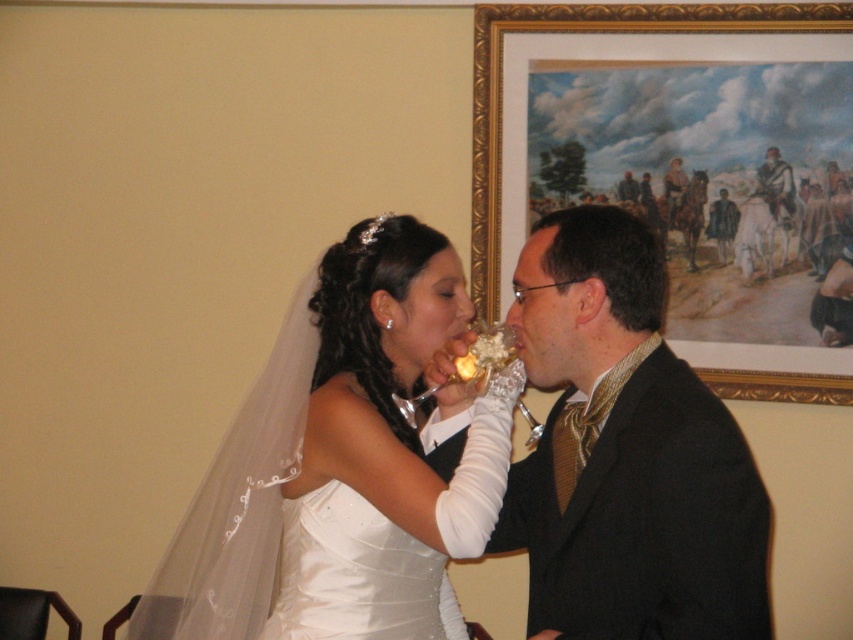
Question: Which point is closer to the camera taking this photo?

Choices:
 (A) (334, 314)
 (B) (775, 388)

Answer: (A)

Question: Is shiny gold tie at center to the left of white satin dress at center from the viewer's perspective?

Choices:
 (A) no
 (B) yes

Answer: (A)

Question: Can you confirm if shiny gold tie at center is thinner than white satin dress at center?

Choices:
 (A) yes
 (B) no

Answer: (B)

Question: Among these objects, which one is nearest to the camera?

Choices:
 (A) gold-framed painting at upper right
 (B) shiny gold tie at center

Answer: (B)

Question: Which object is farther from the camera taking this photo?

Choices:
 (A) white satin dress at center
 (B) shiny gold tie at center

Answer: (A)

Question: Is shiny gold tie at center bigger than gold-framed painting at upper right?

Choices:
 (A) yes
 (B) no

Answer: (B)